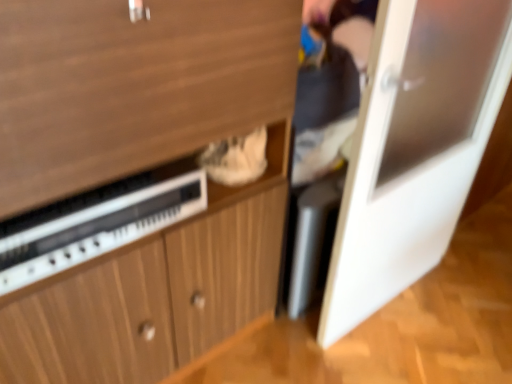
Where is `free spot below white glossy door at right (from a real-world perspective)`? free spot below white glossy door at right (from a real-world perspective) is located at coordinates (379, 314).